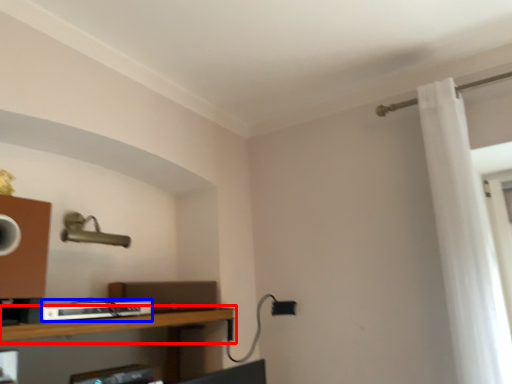
Question: Which of the following is the farthest to the observer, shelf (highlighted by a red box) or equipment (highlighted by a blue box)?

Choices:
 (A) shelf
 (B) equipment

Answer: (B)